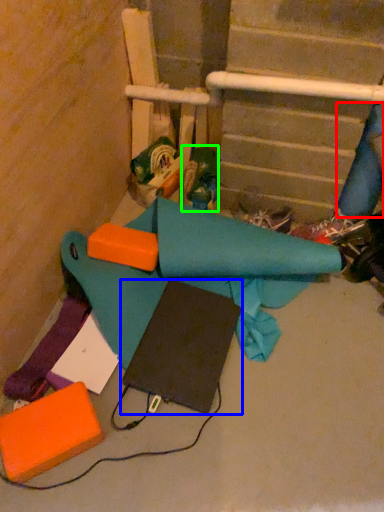
Question: Which object is positioned closest to fabric (highlighted by a red box)? Select from notebook (highlighted by a blue box) and toy (highlighted by a green box).

Choices:
 (A) notebook
 (B) toy

Answer: (B)